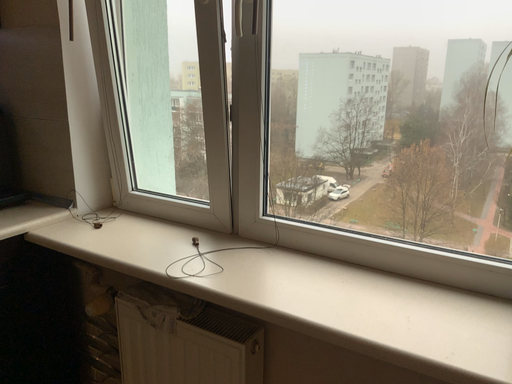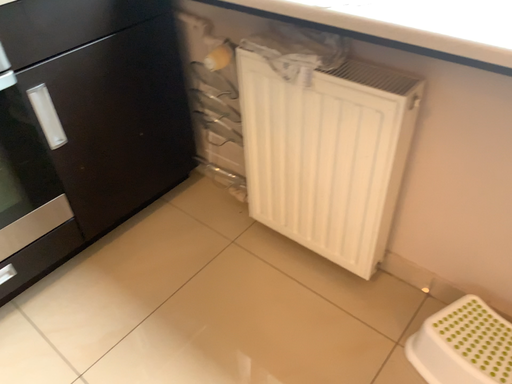
Question: Which way did the camera rotate in the video?

Choices:
 (A) rotated upward
 (B) rotated downward

Answer: (B)